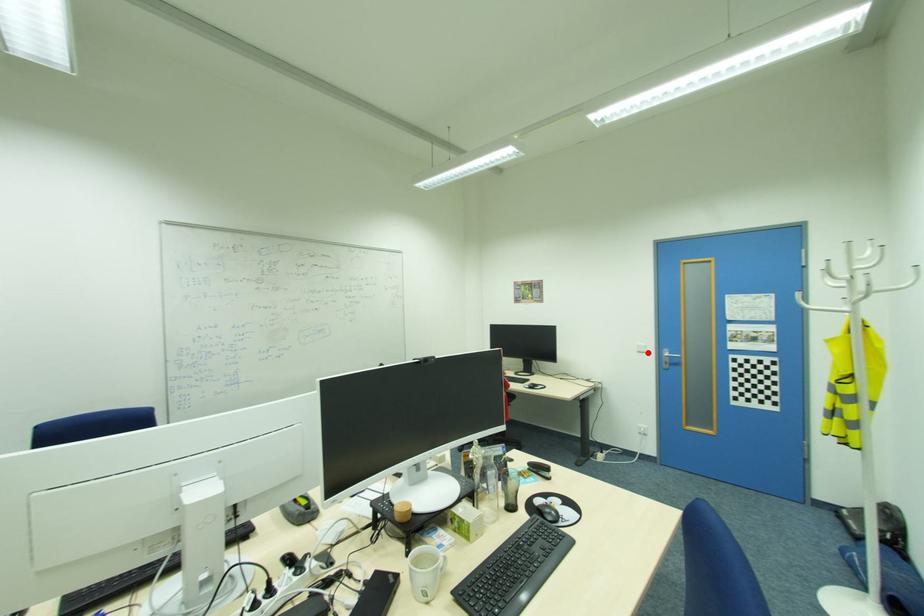
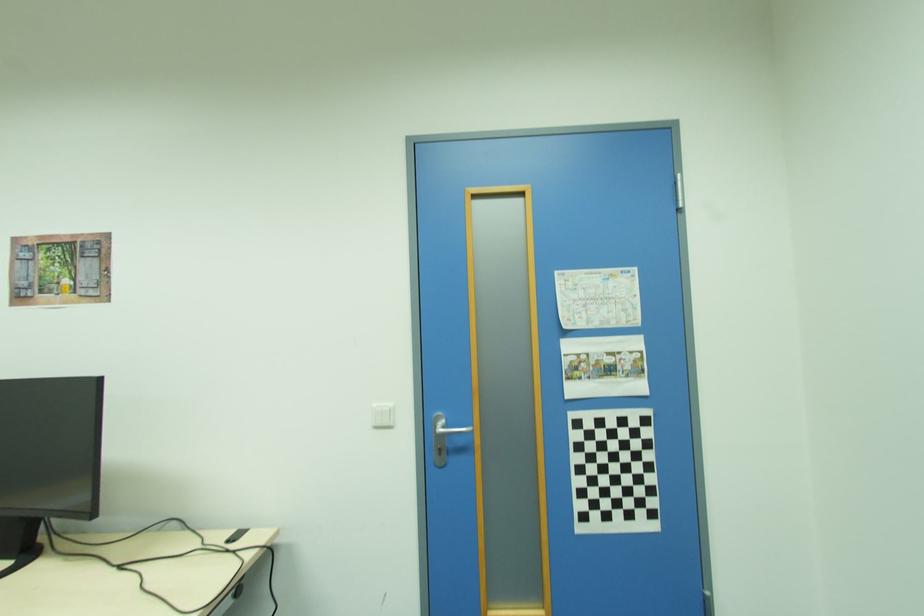
In the second image, find the point that corresponds to the highlighted location in the first image.

(394, 427)